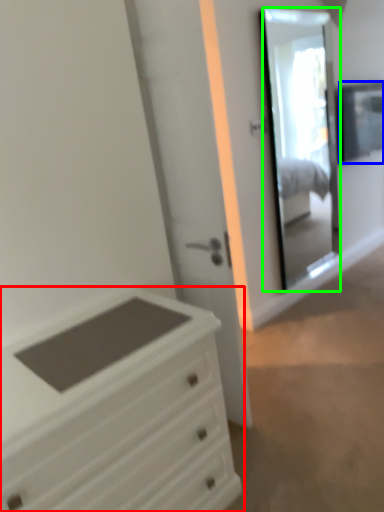
Question: Which is farther away from chest of drawers (highlighted by a red box)? window (highlighted by a blue box) or mirror (highlighted by a green box)?

Choices:
 (A) window
 (B) mirror

Answer: (A)